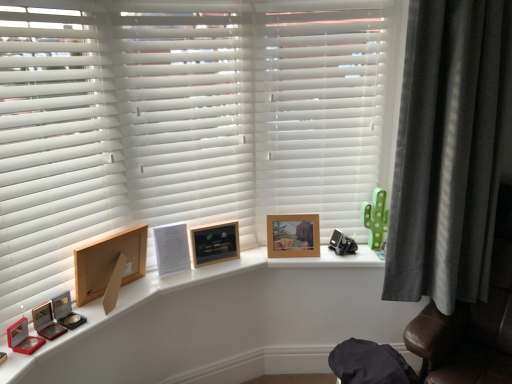
Identify the location of free space in front of wooden photo frame at center, the second picture frame in the left-to-right sequence. This screenshot has width=512, height=384. (212, 269).